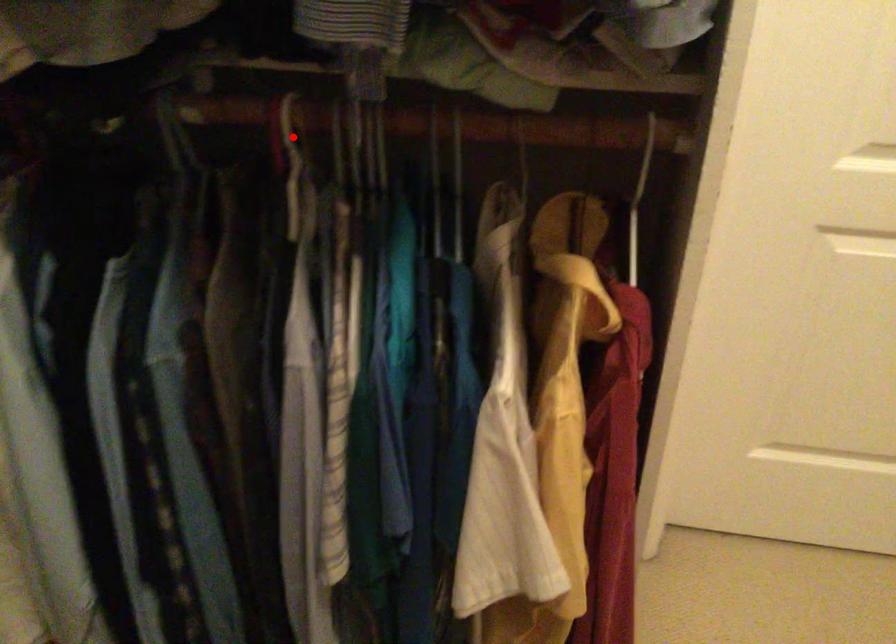
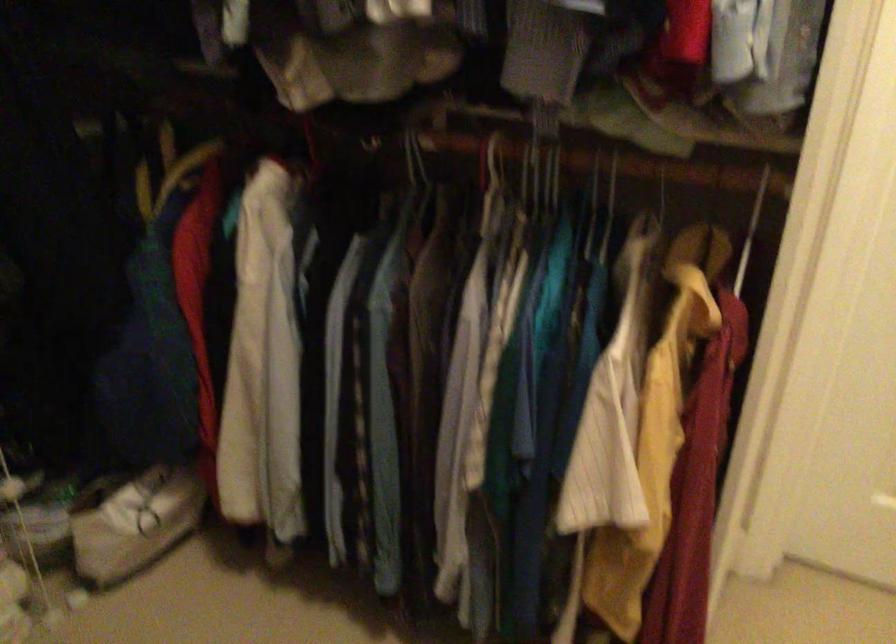
In the second image, find the point that corresponds to the highlighted location in the first image.

(494, 161)